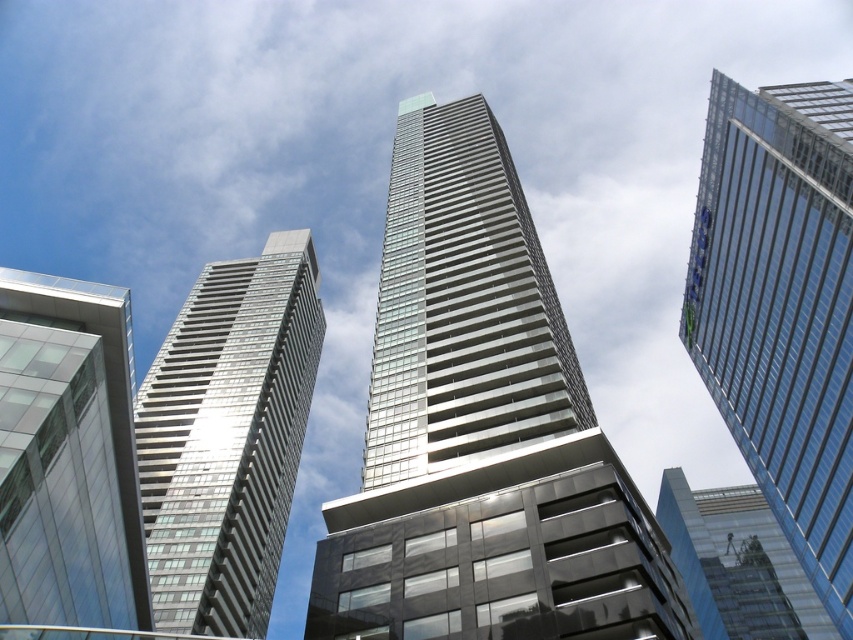
Question: Does transparent glass building at lower left appear under transparent glass skyscraper at upper right?

Choices:
 (A) yes
 (B) no

Answer: (B)

Question: Which point is farther to the camera?

Choices:
 (A) silver glass skyscraper at left
 (B) clear glass skyscraper at upper right

Answer: (B)

Question: Which point is farther to the camera?

Choices:
 (A) transparent glass skyscraper at upper right
 (B) transparent glass building at lower left
 (C) glassy silver skyscraper at center

Answer: (A)

Question: Is glassy silver skyscraper at center to the right of transparent glass skyscraper at upper right from the viewer's perspective?

Choices:
 (A) yes
 (B) no

Answer: (B)

Question: Which object appears closest to the camera in this image?

Choices:
 (A) clear glass skyscraper at upper right
 (B) transparent glass building at lower left
 (C) silver glass skyscraper at left
 (D) transparent glass skyscraper at upper right

Answer: (B)

Question: Is glassy silver skyscraper at center below transparent glass skyscraper at upper right?

Choices:
 (A) yes
 (B) no

Answer: (B)